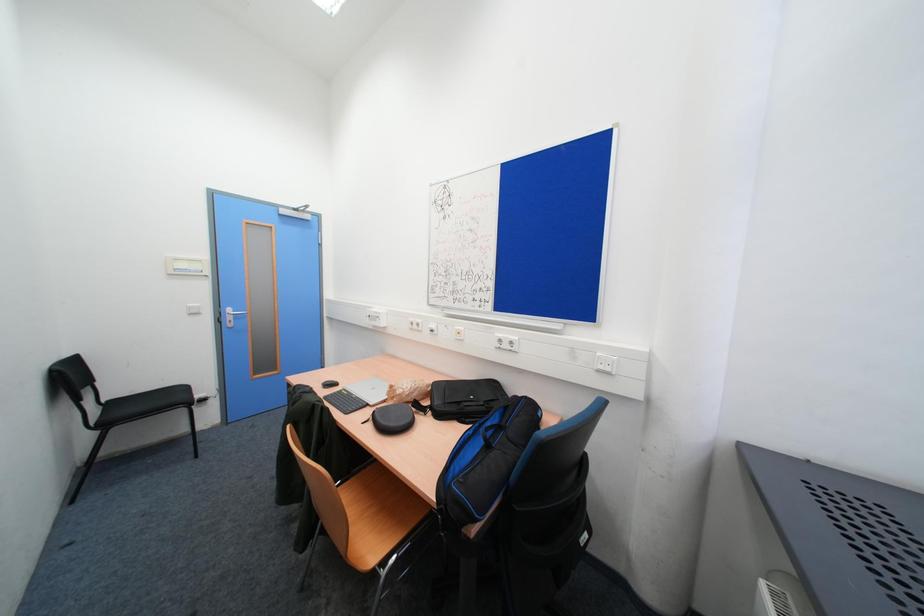
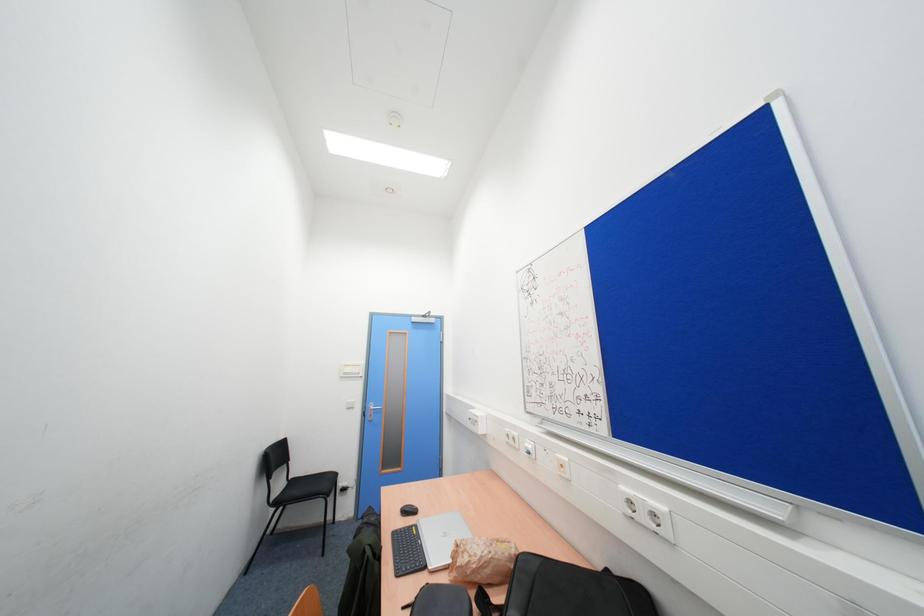
The images are taken continuously from a first-person perspective. In which direction is your viewpoint rotating?

The rotation direction of the camera is left-up.